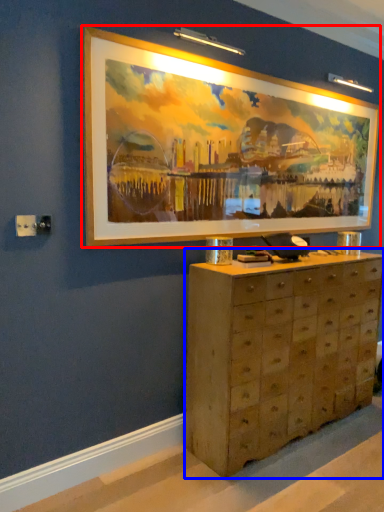
Question: Which object appears closest to the camera in this image, picture frame (highlighted by a red box) or chest of drawers (highlighted by a blue box)?

Choices:
 (A) picture frame
 (B) chest of drawers

Answer: (A)